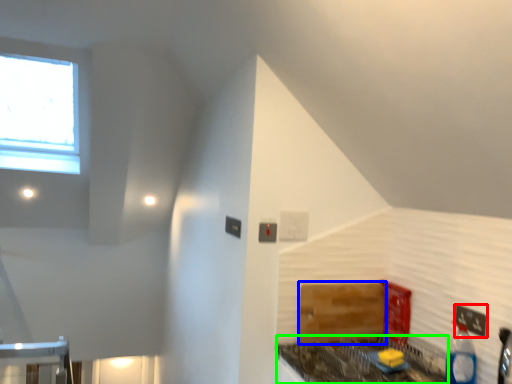
Question: Based on their relative distances, which object is nearer to electric outlet (highlighted by a red box)? Choose from cabinetry (highlighted by a blue box) and counter top (highlighted by a green box).

Choices:
 (A) cabinetry
 (B) counter top

Answer: (B)